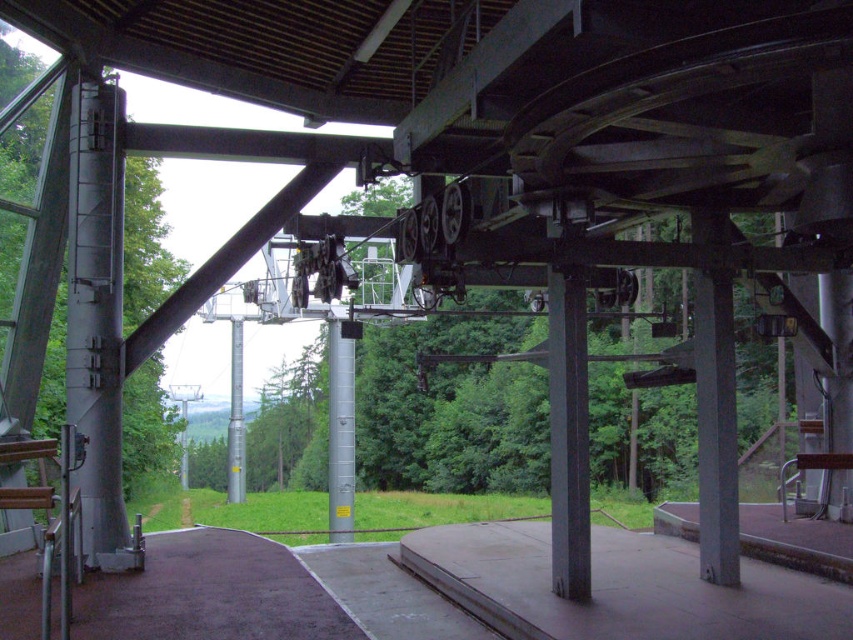
Question: Does silver metallic pole at center have a smaller size compared to metallic pole at center?

Choices:
 (A) yes
 (B) no

Answer: (B)

Question: Observing the image, what is the correct spatial positioning of silver metallic pole at center in reference to metallic pole at center?

Choices:
 (A) left
 (B) right

Answer: (B)

Question: Which point is farther to the camera?

Choices:
 (A) silver metallic pole at center
 (B) metallic pole at center

Answer: (B)

Question: Where is silver metallic pole at center located in relation to metallic pole at center in the image?

Choices:
 (A) right
 (B) left

Answer: (A)